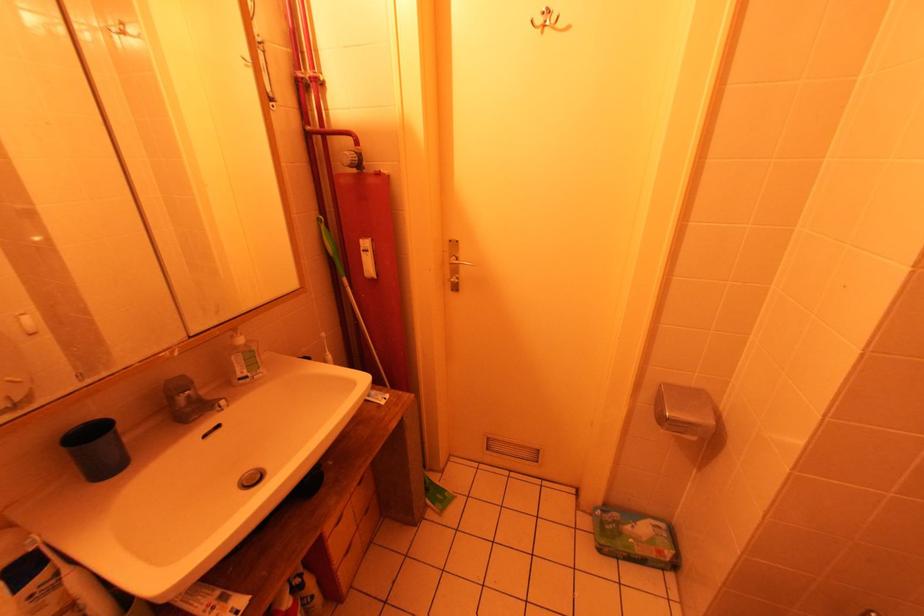
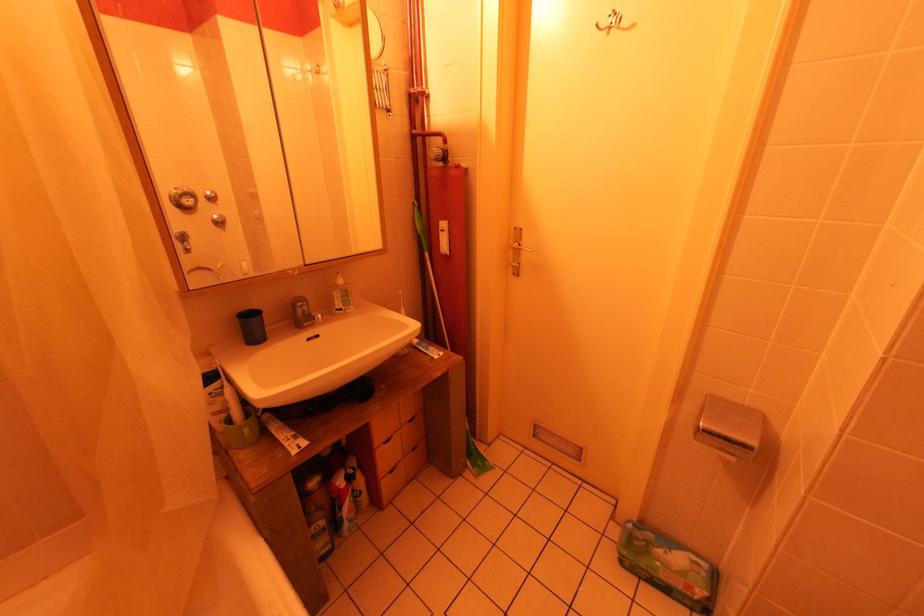
The images are taken continuously from a first-person perspective. In which direction are you moving?

The movement direction of the cameraman is right, backward.